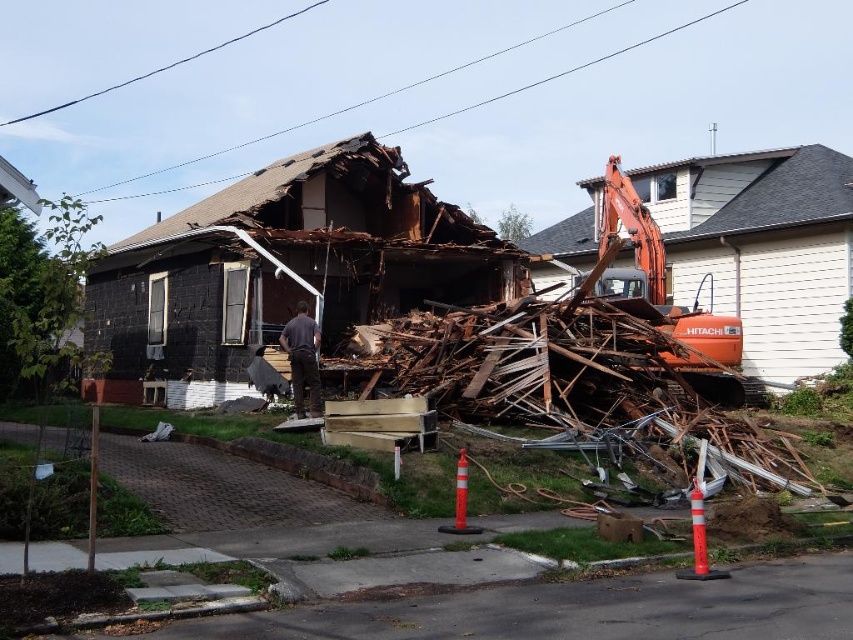
Does point (688, 380) come behind point (306, 316)?

Yes, point (688, 380) is farther from viewer.

Is point (686, 308) behind point (289, 337)?

Yes, point (686, 308) is behind point (289, 337).

Image resolution: width=853 pixels, height=640 pixels. I want to click on orange metallic excavator at center, so click(x=665, y=292).